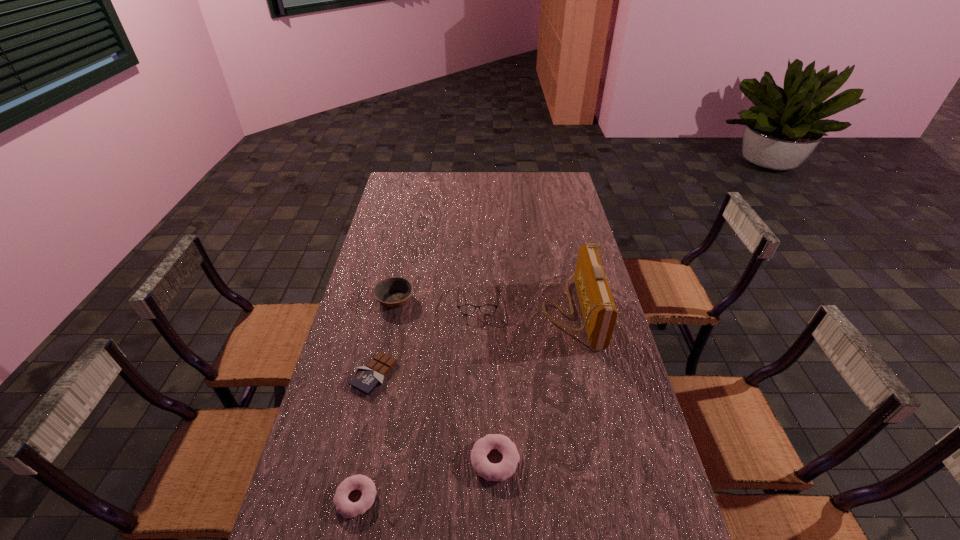
At what (x,y) coordinates should I click in order to perform the action: click on vacant space located on the front of the bowl. Please return your answer as a coordinate pair (x, y). The height and width of the screenshot is (540, 960). Looking at the image, I should click on (387, 338).

Locate an element on the screen. vacant space positioned on the front-facing side of the spectacles is located at coordinates (477, 407).

Identify the location of free location located 0.330m on the right of the third nearest object. This screenshot has width=960, height=540. (505, 374).

Find the location of a particular element. The image size is (960, 540). blank area located 0.080m on the decorative side of the rightmost object is located at coordinates (519, 310).

This screenshot has width=960, height=540. I want to click on vacant space situated 0.270m on the decorative side of the rightmost object, so click(x=465, y=310).

The width and height of the screenshot is (960, 540). Find the location of `vacant space located on the decorative side of the rightmost object`. vacant space located on the decorative side of the rightmost object is located at coordinates coord(450,310).

What are the coordinates of `object that is positioned at the near edge` in the screenshot? It's located at (348, 509).

This screenshot has width=960, height=540. Find the location of `doughnut at the left edge`. doughnut at the left edge is located at coordinates (348, 509).

Identify the location of bowl at the left edge. The image size is (960, 540). (393, 292).

The image size is (960, 540). I want to click on chocolate bar positioned at the left edge, so click(x=367, y=378).